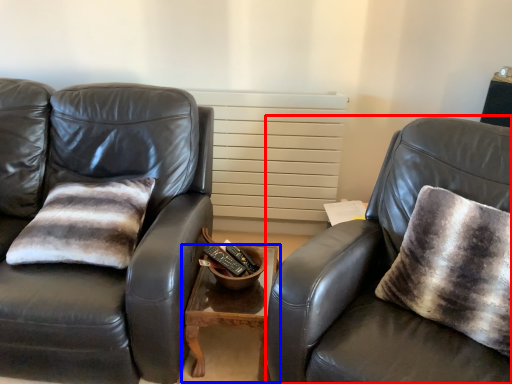
Question: Which object appears closest to the camera in this image, chair (highlighted by a red box) or table (highlighted by a blue box)?

Choices:
 (A) chair
 (B) table

Answer: (A)